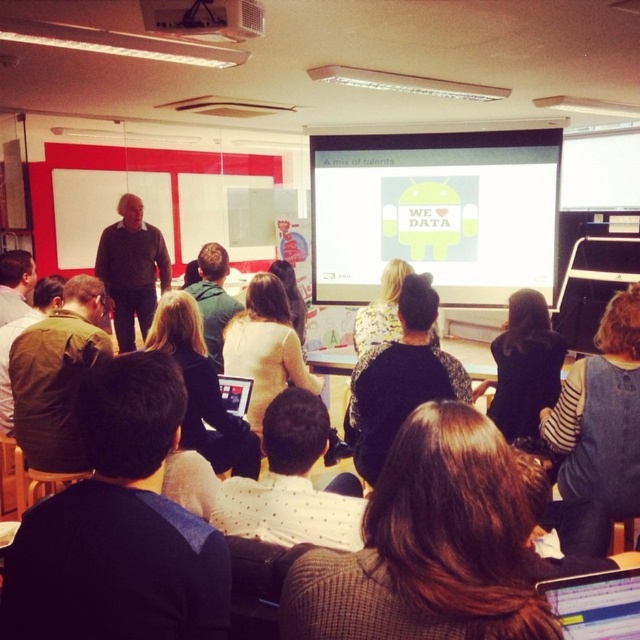
You are organizing a classroom activity and need to decide which fabric item to use for a demonstration. The dark blue fabric at center and the green fabric jacket at left are available. Which one is smaller in size?

The dark blue fabric at center has a smaller size compared to the green fabric jacket at left, so it is the smaller one.